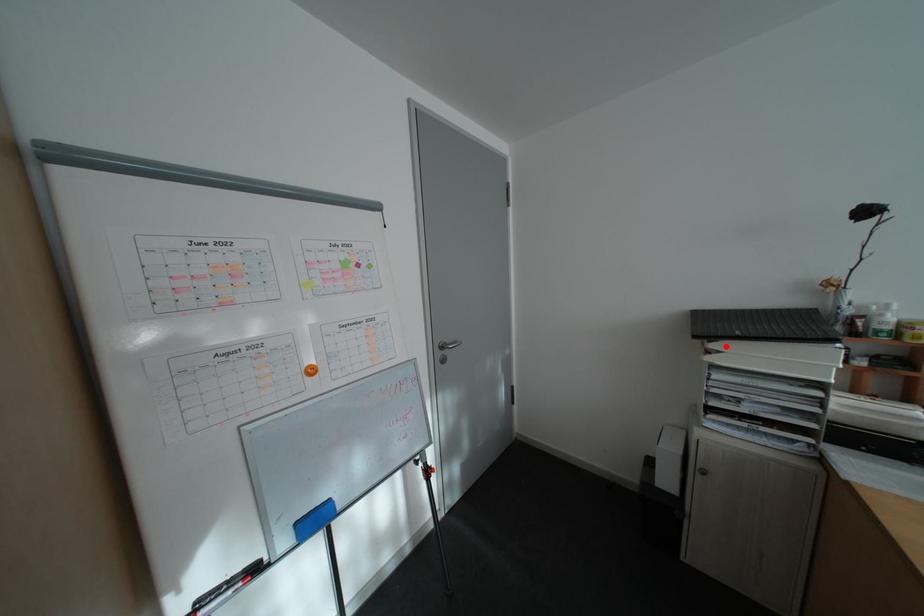
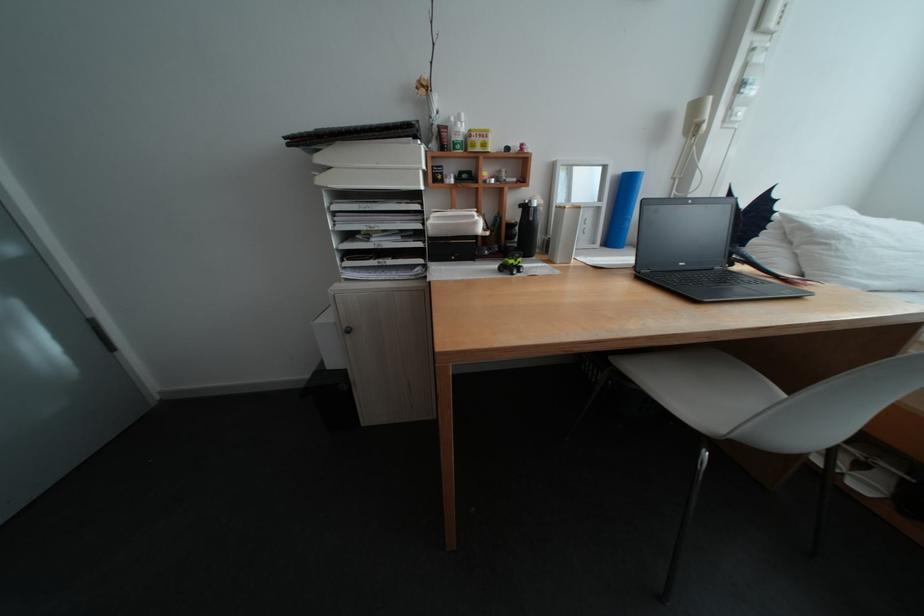
In the second image, find the point that corresponds to the highlighted location in the first image.

(333, 160)